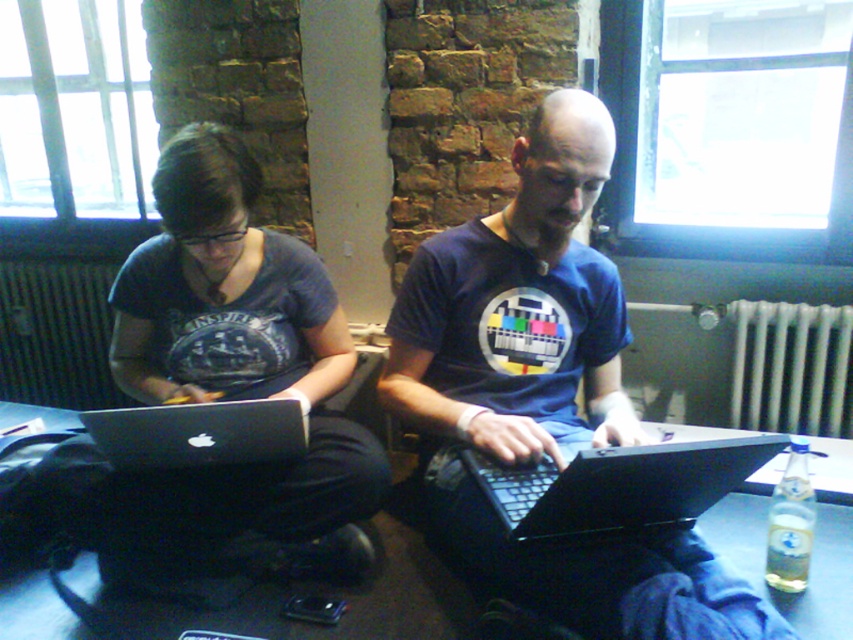
Question: Based on their relative distances, which object is nearer to the black plastic table at center?

Choices:
 (A) silver metallic laptop at center
 (B) black plastic laptop at center
 (C) matte black laptop at center

Answer: (A)

Question: Based on their relative distances, which object is farther from the black plastic table at center?

Choices:
 (A) silver metallic laptop at center
 (B) matte black laptop at center
 (C) black plastic laptop at center

Answer: (B)

Question: Among these points, which one is farthest from the camera?

Choices:
 (A) (283, 442)
 (B) (676, 486)

Answer: (A)

Question: Can you confirm if black plastic table at center is positioned to the right of white metallic radiator at right?

Choices:
 (A) no
 (B) yes

Answer: (A)

Question: Considering the relative positions of black plastic table at center and black plastic laptop at center in the image provided, where is black plastic table at center located with respect to black plastic laptop at center?

Choices:
 (A) below
 (B) above

Answer: (A)

Question: Can you confirm if black plastic table at center is bigger than black plastic laptop at center?

Choices:
 (A) yes
 (B) no

Answer: (A)